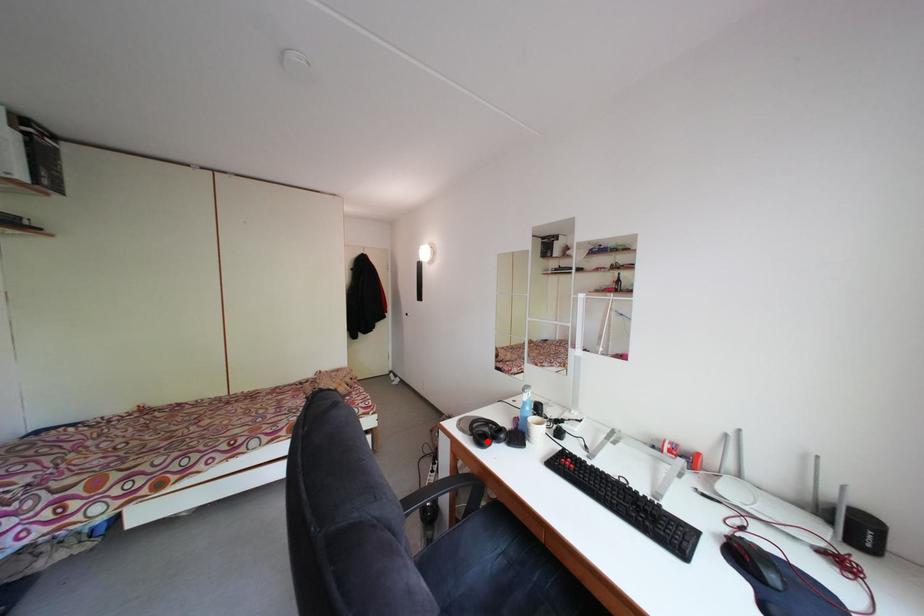
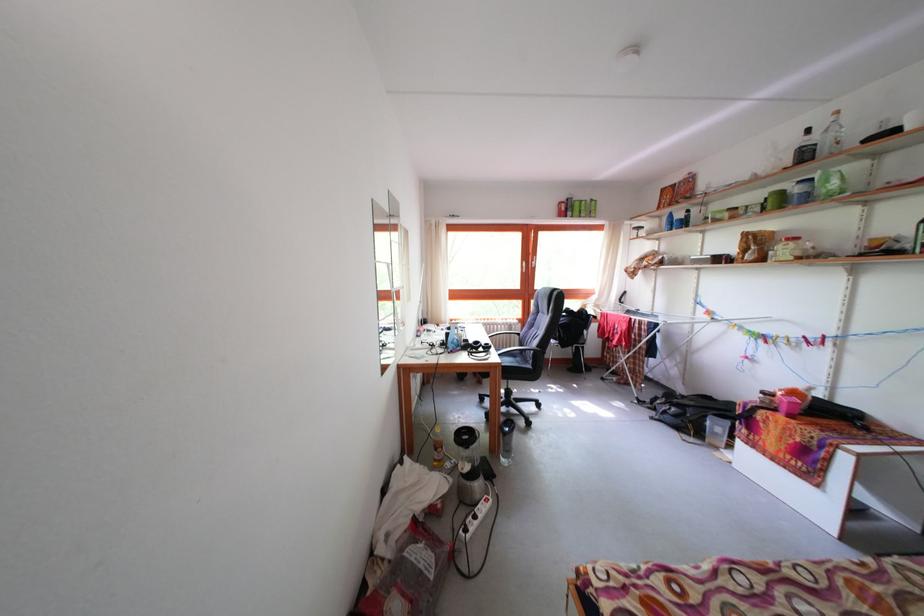
Question: I am providing you with two images of the same scene from different viewpoints. A red point is marked on the first image. At the location where the point appears in image 1, is it still visible in image 2?

Choices:
 (A) Yes
 (B) No

Answer: (A)